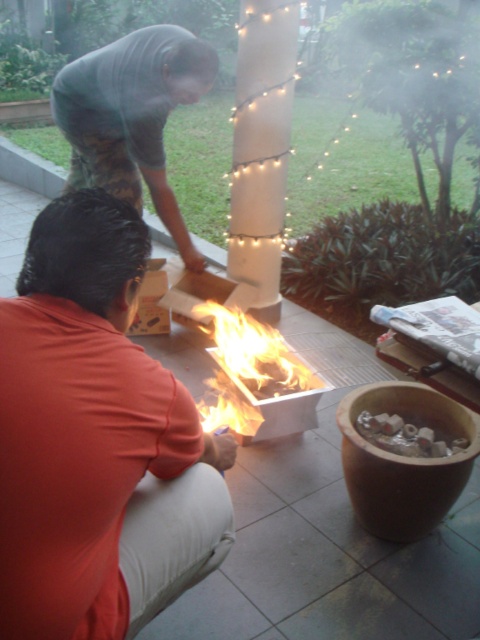
Question: Which object is positioned farthest from the flaming wood at center?

Choices:
 (A) dark gray shirt at upper left
 (B) orange cotton shirt at lower left

Answer: (A)

Question: Can you confirm if dark gray shirt at upper left is positioned to the left of flaming wood at center?

Choices:
 (A) yes
 (B) no

Answer: (A)

Question: Which is farther from the dark gray shirt at upper left?

Choices:
 (A) flaming wood at center
 (B) orange cotton shirt at lower left

Answer: (B)

Question: Does orange cotton shirt at lower left appear on the right side of dark gray shirt at upper left?

Choices:
 (A) no
 (B) yes

Answer: (B)

Question: Is orange cotton shirt at lower left positioned at the back of flaming wood at center?

Choices:
 (A) no
 (B) yes

Answer: (A)

Question: Which of the following is the farthest from the observer?

Choices:
 (A) orange cotton shirt at lower left
 (B) flaming wood at center
 (C) dark gray shirt at upper left

Answer: (C)